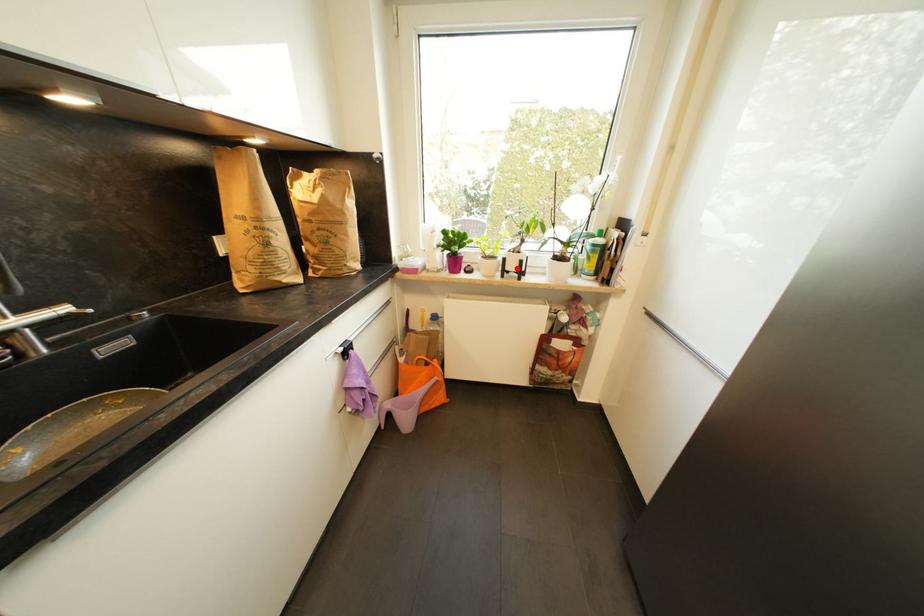
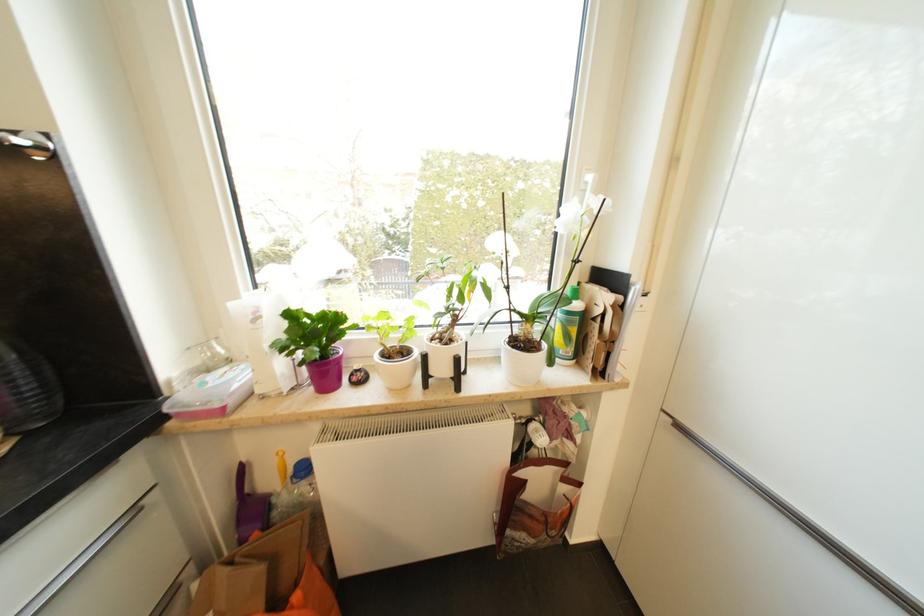
Question: I am providing you with two images of the same scene from different viewpoints. A red point is shown in image1. For the corresponding object point in image2, is it positioned nearer or farther from the camera?

Choices:
 (A) Nearer
 (B) Farther

Answer: (B)